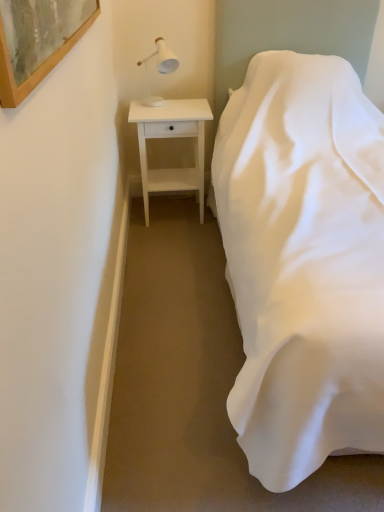
Identify the location of vacant area that is situated to the right of white matte table lamp at upper left. The image size is (384, 512). (196, 103).